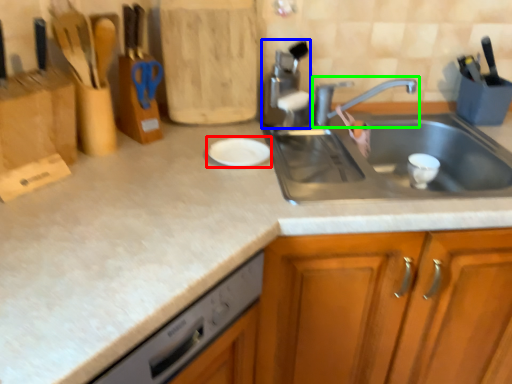
Question: Considering the real-world distances, which object is farthest from plate (highlighted by a red box)? appliance (highlighted by a blue box) or tap (highlighted by a green box)?

Choices:
 (A) appliance
 (B) tap

Answer: (B)